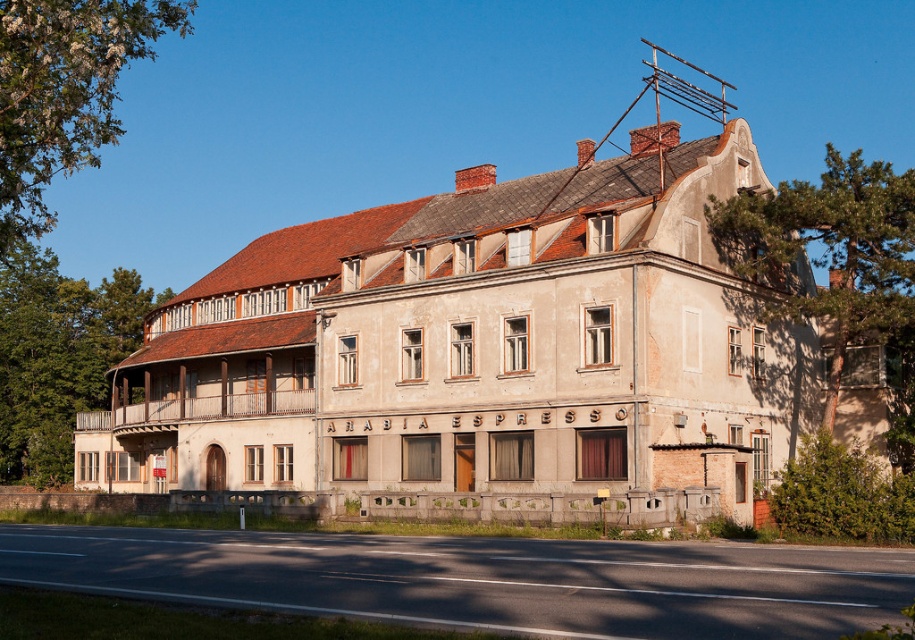
Question: Does green leafy tree at upper right have a greater width compared to green leafy tree at upper left?

Choices:
 (A) no
 (B) yes

Answer: (B)

Question: Considering the relative positions of green leafy tree at upper left and green leafy tree at left in the image provided, where is green leafy tree at upper left located with respect to green leafy tree at left?

Choices:
 (A) below
 (B) above

Answer: (B)

Question: Which object appears farthest from the camera in this image?

Choices:
 (A) green leafy tree at left
 (B) green leafy tree at upper right

Answer: (A)

Question: Estimate the real-world distances between objects in this image. Which object is farther from the green leafy tree at left?

Choices:
 (A) green leafy tree at upper right
 (B) green leafy tree at upper left

Answer: (A)

Question: Which object is positioned closest to the green leafy tree at left?

Choices:
 (A) green leafy tree at upper right
 (B) green leafy tree at upper left

Answer: (B)

Question: Does green leafy tree at upper left have a larger size compared to green leafy tree at left?

Choices:
 (A) yes
 (B) no

Answer: (A)